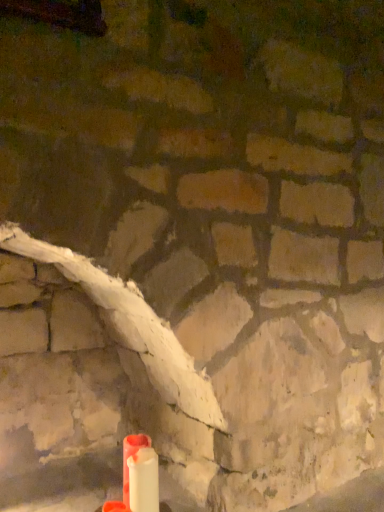
In order to click on white matte candle at lower center in this screenshot , I will do 130,455.

The width and height of the screenshot is (384, 512). What do you see at coordinates (130, 455) in the screenshot?
I see `white matte candle at lower center` at bounding box center [130, 455].

Locate an element on the screen. The width and height of the screenshot is (384, 512). white matte candle at lower center is located at coordinates (130, 455).